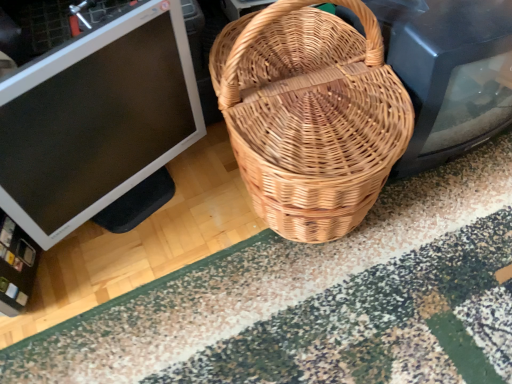
Question: Is natural woven picnic basket at center not near matte black monitor at left?

Choices:
 (A) no
 (B) yes

Answer: (A)

Question: From a real-world perspective, is natural woven picnic basket at center on matte black monitor at left?

Choices:
 (A) no
 (B) yes

Answer: (B)

Question: Are natural woven picnic basket at center and matte black monitor at left making contact?

Choices:
 (A) yes
 (B) no

Answer: (B)

Question: Considering the relative sizes of natural woven picnic basket at center and matte black monitor at left in the image provided, is natural woven picnic basket at center bigger than matte black monitor at left?

Choices:
 (A) yes
 (B) no

Answer: (A)

Question: From a real-world perspective, does natural woven picnic basket at center sit lower than matte black monitor at left?

Choices:
 (A) yes
 (B) no

Answer: (B)

Question: From the image's perspective, is patterned carpet at center positioned above or below matte black monitor at left?

Choices:
 (A) above
 (B) below

Answer: (B)

Question: Looking at their shapes, would you say patterned carpet at center is wider or thinner than matte black monitor at left?

Choices:
 (A) thin
 (B) wide

Answer: (B)

Question: From a real-world perspective, is patterned carpet at center above or below matte black monitor at left?

Choices:
 (A) below
 (B) above

Answer: (A)

Question: Do you think patterned carpet at center is within matte black monitor at left, or outside of it?

Choices:
 (A) outside
 (B) inside

Answer: (A)

Question: Is point (224, 288) closer or farther from the camera than point (400, 132)?

Choices:
 (A) farther
 (B) closer

Answer: (A)

Question: Is patterned carpet at center spatially inside natural woven picnic basket at center, or outside of it?

Choices:
 (A) outside
 (B) inside

Answer: (A)

Question: In terms of height, does patterned carpet at center look taller or shorter compared to natural woven picnic basket at center?

Choices:
 (A) tall
 (B) short

Answer: (B)

Question: From a real-world perspective, is patterned carpet at center physically located above or below natural woven picnic basket at center?

Choices:
 (A) below
 (B) above

Answer: (A)

Question: From their relative heights in the image, would you say matte black monitor at left is taller or shorter than patterned carpet at center?

Choices:
 (A) short
 (B) tall

Answer: (B)

Question: Is point (166, 9) positioned closer to the camera than point (500, 286)?

Choices:
 (A) farther
 (B) closer

Answer: (B)